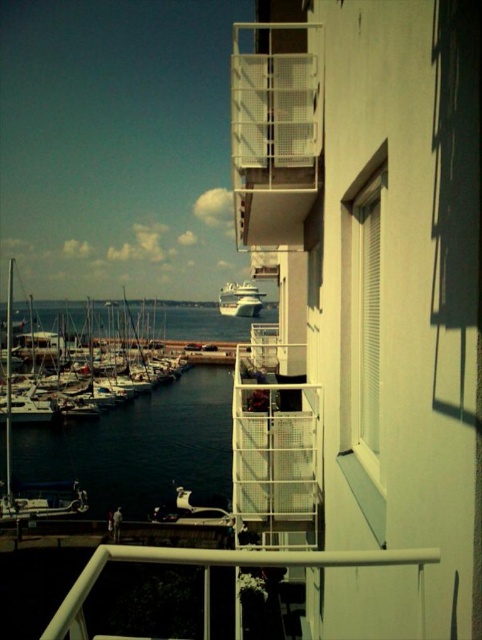
Between dark blue water at lower left and white glossy cruise ship at center, which one has more height?

Standing taller between the two is dark blue water at lower left.

Looking at this image, is dark blue water at lower left thinner than white glossy cruise ship at center?

No.

I want to click on dark blue water at lower left, so click(x=196, y=321).

I want to click on dark blue water at lower left, so click(196, 321).

Looking at this image, which is more to the left, smooth dark water at lower left or dark blue water at lower left?

Positioned to the left is dark blue water at lower left.

From the picture: Does smooth dark water at lower left have a larger size compared to dark blue water at lower left?

No, smooth dark water at lower left is not bigger than dark blue water at lower left.

Between point (41, 452) and point (85, 312), which one is positioned in front?

Point (41, 452) is in front.

This screenshot has width=482, height=640. Find the location of `smooth dark water at lower left`. smooth dark water at lower left is located at coordinates (135, 445).

Who is more forward, [31,435] or [232,314]?

Point [31,435] is in front.

Is point (123, 468) positioned behind point (221, 291)?

No, it is in front of (221, 291).

Identify the location of smooth dark water at lower left. (135, 445).